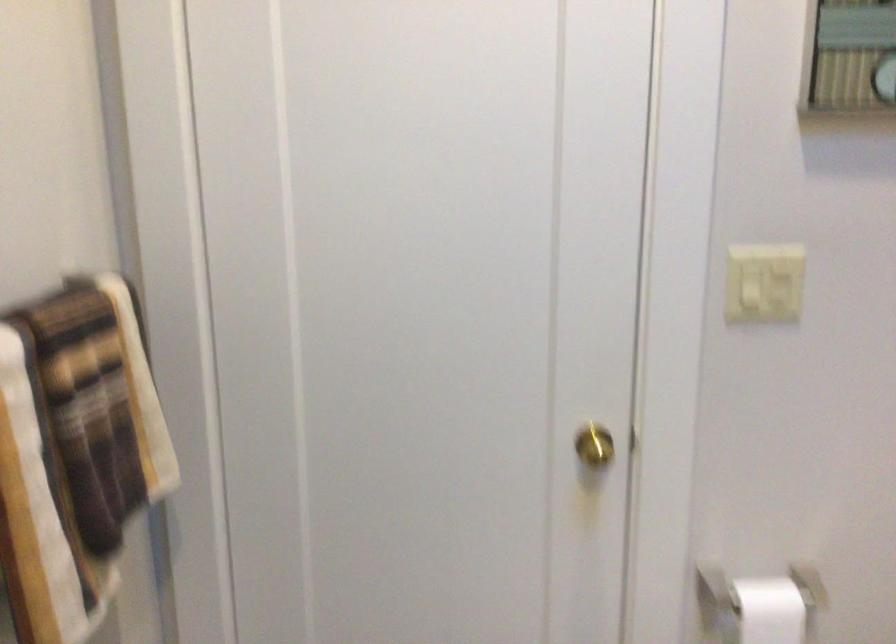
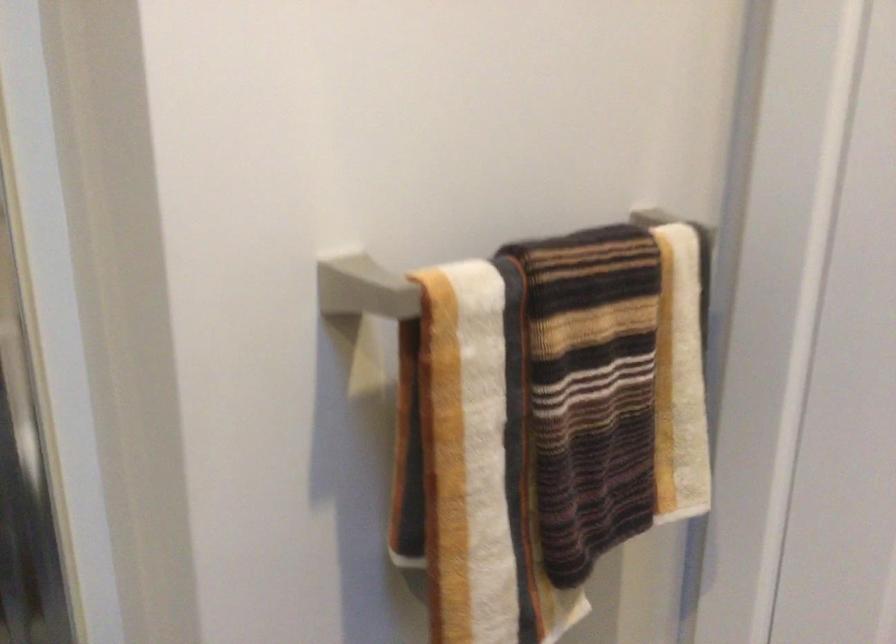
Find the pixel in the second image that matches pixel 90 404 in the first image.

(590, 389)